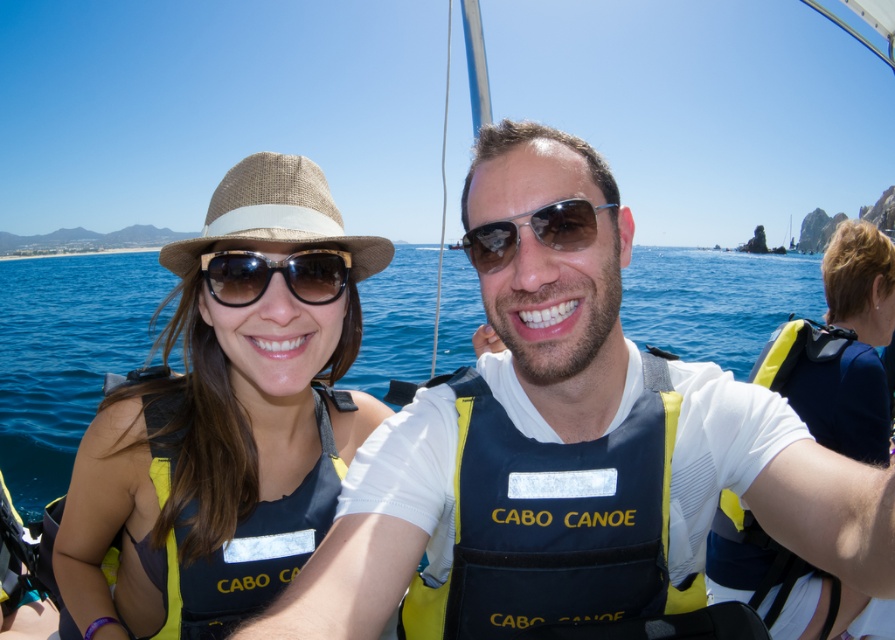
You are standing on the deck of a boat and want to reach the point at coordinates point (634, 428). If you can stretch your arm 3 feet, will you be able to touch it?

The point (634, 428) is 8.37 feet away from the viewer. Since you can only stretch your arm 3 feet, you cannot reach the point (634, 428).

You are a photographer on a boat and want to capture a wide shot of the blue water at center and the yellow and navy blue life vest at left. Given that the camera can only focus on one object at a time, which object should you prioritize to ensure the entire width of the subject fits in the frame?

The blue water at center has a greater width than the yellow and navy blue life vest at left. To ensure the entire width fits in the frame, prioritize focusing on the blue water at center since it is wider and requires more space.